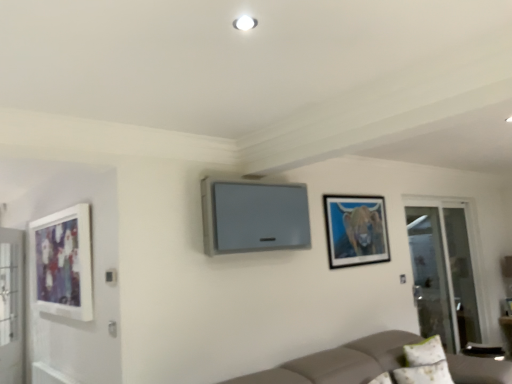
Question: Considering the positions of transparent glass screen door at right, the 1th screen door in the right-to-left sequence, and matte black picture frame at upper right, which is the second picture frame in left-to-right order, in the image, is transparent glass screen door at right, the 1th screen door in the right-to-left sequence, taller or shorter than matte black picture frame at upper right, which is the second picture frame in left-to-right order,?

Choices:
 (A) short
 (B) tall

Answer: (B)

Question: Is transparent glass screen door at right, which ranks as the 1th screen door in back-to-front order, in front of or behind matte black picture frame at upper right, marked as the first picture frame in a right-to-left arrangement, in the image?

Choices:
 (A) front
 (B) behind

Answer: (B)

Question: Which is farther from the matte white picture frame at left, the 2th picture frame when ordered from right to left?

Choices:
 (A) matte black picture frame at upper right, marked as the first picture frame in a right-to-left arrangement
 (B) transparent glass screen door at right, the 2th screen door from the front
 (C) white fabric pillow at lower right
 (D) clear glass screen door at left, the second screen door positioned from the right

Answer: (B)

Question: Estimate the real-world distances between objects in this image. Which object is farther from the white fabric pillow at lower right?

Choices:
 (A) matte white picture frame at left, the 2th picture frame when ordered from right to left
 (B) matte black picture frame at upper right, marked as the first picture frame in a right-to-left arrangement
 (C) transparent glass screen door at right, which ranks as the 1th screen door in back-to-front order
 (D) clear glass screen door at left, which is the 2th screen door from back to front

Answer: (D)